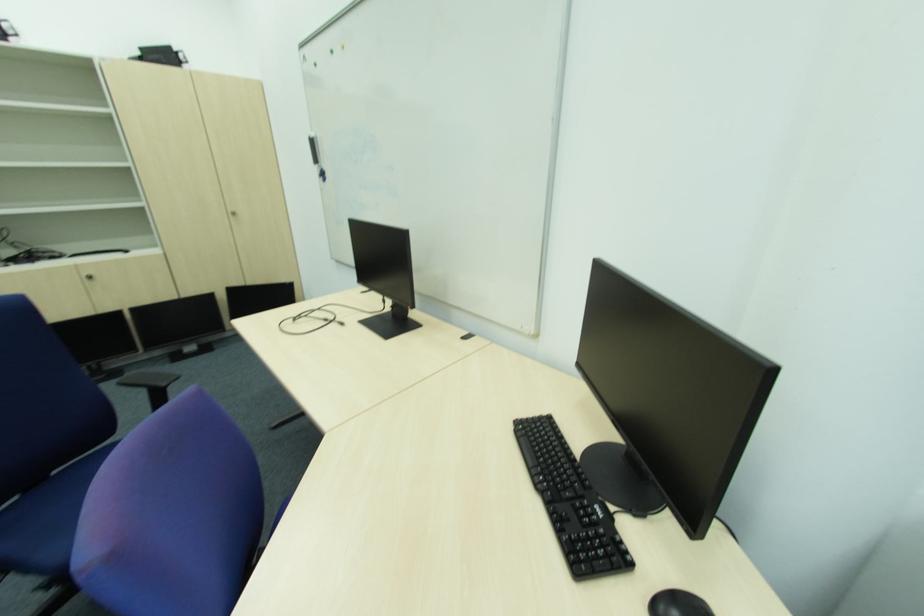
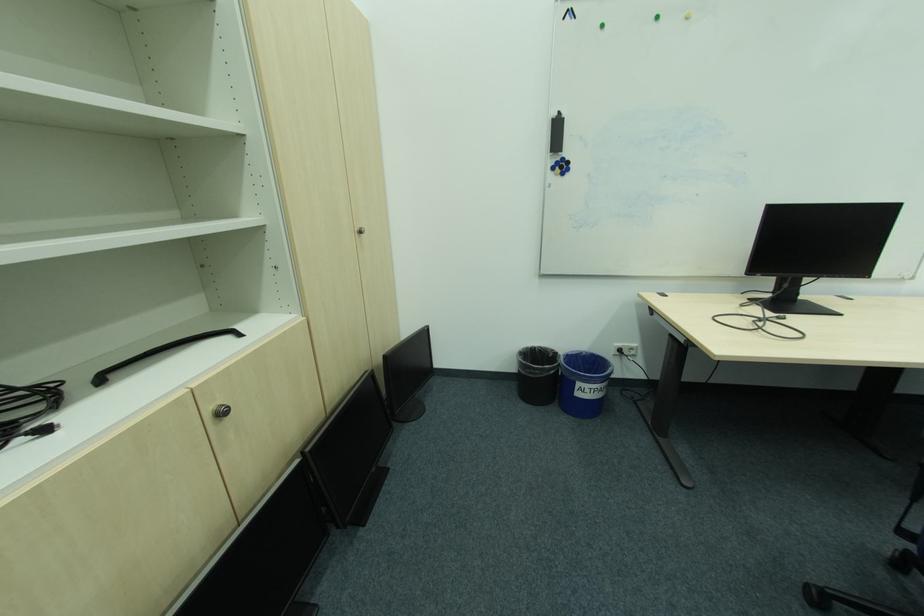
In the second image, find the point that corresponds to point 236,213 in the first image.

(363, 229)